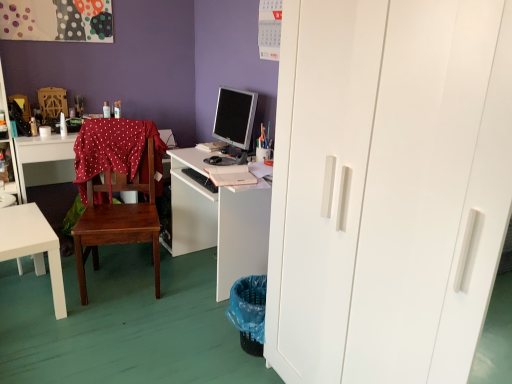
Describe the element at coordinates (33, 246) in the screenshot. I see `white glossy table at lower left, which ranks as the first desk in left-to-right order` at that location.

Locate an element on the screen. Image resolution: width=512 pixels, height=384 pixels. silver metallic monitor at center is located at coordinates (234, 117).

What do you see at coordinates (116, 189) in the screenshot?
I see `wooden chair at center` at bounding box center [116, 189].

In order to face white matte desk at center, the first desk when ordered from right to left, should I rotate leftwards or rightwards?

Turn left by 3.188 degrees to look at white matte desk at center, the first desk when ordered from right to left.

Image resolution: width=512 pixels, height=384 pixels. What do you see at coordinates (219, 221) in the screenshot?
I see `white matte desk at center, the first desk when ordered from right to left` at bounding box center [219, 221].

Image resolution: width=512 pixels, height=384 pixels. Find the location of `white glossy table at lower left, marked as the third desk in a right-to-left arrangement`. white glossy table at lower left, marked as the third desk in a right-to-left arrangement is located at coordinates click(x=33, y=246).

Are red polka dot fabric at center and black matte keyboard at center beside each other?

red polka dot fabric at center is not next to black matte keyboard at center, and they're not touching.

Relative to black matte keyboard at center, is red polka dot fabric at center in front or behind?

red polka dot fabric at center is positioned farther from the viewer than black matte keyboard at center.

Between point (88, 128) and point (202, 179), which one is positioned behind?

Point (202, 179)

From the image's perspective, which is above, red polka dot fabric at center or black matte keyboard at center?

red polka dot fabric at center is shown above in the image.

Which of these two, white matte desk at center, positioned as the 3th desk in left-to-right order, or red polka dot fabric at center, stands taller?

Standing taller between the two is white matte desk at center, positioned as the 3th desk in left-to-right order.

Does white matte desk at center, the first desk when ordered from right to left, have a lesser width compared to red polka dot fabric at center?

No, white matte desk at center, the first desk when ordered from right to left, is not thinner than red polka dot fabric at center.

Is point (267, 191) closer or farther from the camera than point (123, 158)?

Clearly, point (267, 191) is closer to the camera than point (123, 158).

Which object is further away from the camera taking this photo, white matte desk at center, the first desk when ordered from right to left, or red polka dot fabric at center?

red polka dot fabric at center is further from the camera.

Can black matte keyboard at center be found inside silver metallic monitor at center?

No, black matte keyboard at center is not surrounded by silver metallic monitor at center.

Between silver metallic monitor at center and black matte keyboard at center, which one has smaller width?

black matte keyboard at center.

Is silver metallic monitor at center further to camera compared to black matte keyboard at center?

Yes, silver metallic monitor at center is further from the camera.

Is the surface of silver metallic monitor at center in direct contact with black matte keyboard at center?

silver metallic monitor at center and black matte keyboard at center are not in contact.

Between black matte keyboard at center and silver metallic monitor at center, which one has larger size?

Bigger between the two is silver metallic monitor at center.

Locate an element on the screen. Image resolution: width=512 pixels, height=384 pixels. computer keyboard that appears in front of the silver metallic monitor at center is located at coordinates (200, 179).

Does black matte keyboard at center turn towards silver metallic monitor at center?

No.

Between black matte keyboard at center and red polka dot fabric at center, which one has smaller size?

Smaller between the two is black matte keyboard at center.

Considering the sizes of objects black matte keyboard at center and red polka dot fabric at center in the image provided, who is wider, black matte keyboard at center or red polka dot fabric at center?

With larger width is red polka dot fabric at center.

From the image's perspective, is black matte keyboard at center on red polka dot fabric at center?

No, from the image's perspective, black matte keyboard at center is not over red polka dot fabric at center.

Is wooden desk at left, positioned as the second desk in right-to-left order, with white glossy coffee cup at upper left?

No, wooden desk at left, positioned as the second desk in right-to-left order, is not next to white glossy coffee cup at upper left.

From the image's perspective, is wooden desk at left, positioned as the second desk in right-to-left order, above white glossy coffee cup at upper left?

Actually, wooden desk at left, positioned as the second desk in right-to-left order, appears below white glossy coffee cup at upper left in the image.

Can you confirm if wooden desk at left, acting as the 2th desk starting from the left, is thinner than white glossy coffee cup at upper left?

In fact, wooden desk at left, acting as the 2th desk starting from the left, might be wider than white glossy coffee cup at upper left.

Which is behind, point (61, 139) or point (41, 130)?

The point (41, 130) is farther from the camera.

Which object is closer to the camera taking this photo, wooden chair at center or white glossy coffee cup at upper left?

wooden chair at center.

Is white glossy coffee cup at upper left at the back of wooden chair at center?

No, wooden chair at center is not facing the opposite direction of white glossy coffee cup at upper left.

Identify the location of coffee cup behind the wooden chair at center. (44, 131).

Can you confirm if wooden chair at center is bigger than white glossy coffee cup at upper left?

Indeed, wooden chair at center has a larger size compared to white glossy coffee cup at upper left.

Where is `tablecloth above the black matte keyboard at center (from a real-world perspective)`? This screenshot has width=512, height=384. tablecloth above the black matte keyboard at center (from a real-world perspective) is located at coordinates (115, 150).

In the image, there is a white matte desk at center, positioned as the 3th desk in left-to-right order. What are the coordinates of `tablecloth above it (from the image's perspective)` in the screenshot? It's located at coord(115,150).

From the image, which object appears to be nearer to white glossy table at lower left, which ranks as the first desk in left-to-right order, red polka dot fabric at center or black matte keyboard at center?

Based on the image, red polka dot fabric at center appears to be nearer to white glossy table at lower left, which ranks as the first desk in left-to-right order.

Based on their spatial positions, is black matte keyboard at center or white glossy table at lower left, marked as the third desk in a right-to-left arrangement, closer to silver metallic monitor at center?

Based on the image, black matte keyboard at center appears to be nearer to silver metallic monitor at center.

Based on their spatial positions, is black matte keyboard at center or red polka dot fabric at center further from white matte desk at center, positioned as the 3th desk in left-to-right order?

Among the two, red polka dot fabric at center is located further to white matte desk at center, positioned as the 3th desk in left-to-right order.

Looking at the image, which one is located closer to white glossy coffee cup at upper left, white glossy table at lower left, which ranks as the first desk in left-to-right order, or black matte keyboard at center?

white glossy table at lower left, which ranks as the first desk in left-to-right order, is closer to white glossy coffee cup at upper left.

Based on their spatial positions, is silver metallic monitor at center or wooden desk at left, acting as the 2th desk starting from the left, closer to red polka dot fabric at center?

wooden desk at left, acting as the 2th desk starting from the left, is closer to red polka dot fabric at center.

When comparing their distances from red polka dot fabric at center, does wooden desk at left, positioned as the second desk in right-to-left order, or black matte keyboard at center seem closer?

wooden desk at left, positioned as the second desk in right-to-left order.

Considering their positions, is red polka dot fabric at center positioned closer to wooden desk at left, positioned as the second desk in right-to-left order, than white matte desk at center, the first desk when ordered from right to left?

The object closer to wooden desk at left, positioned as the second desk in right-to-left order, is red polka dot fabric at center.

Looking at the image, which one is located closer to wooden desk at left, acting as the 2th desk starting from the left, wooden chair at center or white glossy coffee cup at upper left?

white glossy coffee cup at upper left is positioned closer to the anchor wooden desk at left, acting as the 2th desk starting from the left.

Where is `tablecloth positioned between white glossy table at lower left, which ranks as the first desk in left-to-right order, and wooden desk at left, positioned as the second desk in right-to-left order, from near to far`? tablecloth positioned between white glossy table at lower left, which ranks as the first desk in left-to-right order, and wooden desk at left, positioned as the second desk in right-to-left order, from near to far is located at coordinates (115, 150).

Where is `desk between wooden desk at left, positioned as the second desk in right-to-left order, and silver metallic monitor at center, in the horizontal direction`? desk between wooden desk at left, positioned as the second desk in right-to-left order, and silver metallic monitor at center, in the horizontal direction is located at coordinates (219, 221).

In order to click on chair between red polka dot fabric at center and white matte desk at center, positioned as the 3th desk in left-to-right order in this screenshot , I will do `click(116, 189)`.

Locate an element on the screen. This screenshot has width=512, height=384. chair located between white glossy coffee cup at upper left and black matte keyboard at center in the left-right direction is located at coordinates (116, 189).